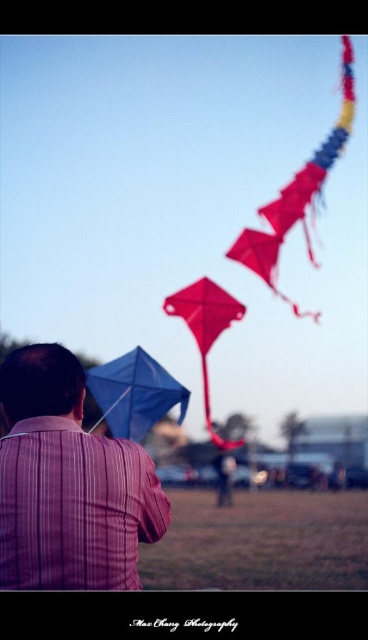
Can you confirm if brown grass at lower center is bigger than red matte kite at center?

Yes.

Can you confirm if brown grass at lower center is positioned to the left of red matte kite at center?

In fact, brown grass at lower center is to the right of red matte kite at center.

What do you see at coordinates (262, 541) in the screenshot?
I see `brown grass at lower center` at bounding box center [262, 541].

At what (x,y) coordinates should I click in order to perform the action: click on brown grass at lower center. Please return your answer as a coordinate pair (x, y). Image resolution: width=368 pixels, height=640 pixels. Looking at the image, I should click on (262, 541).

Is brown grass at lower center closer to camera compared to blue fabric kite at center?

No.

Does brown grass at lower center appear on the right side of blue fabric kite at center?

Indeed, brown grass at lower center is positioned on the right side of blue fabric kite at center.

Does point (172, 506) come in front of point (125, 424)?

No, it is not.

The height and width of the screenshot is (640, 368). In order to click on brown grass at lower center in this screenshot , I will do `click(262, 541)`.

The height and width of the screenshot is (640, 368). I want to click on brown grass at lower center, so click(x=262, y=541).